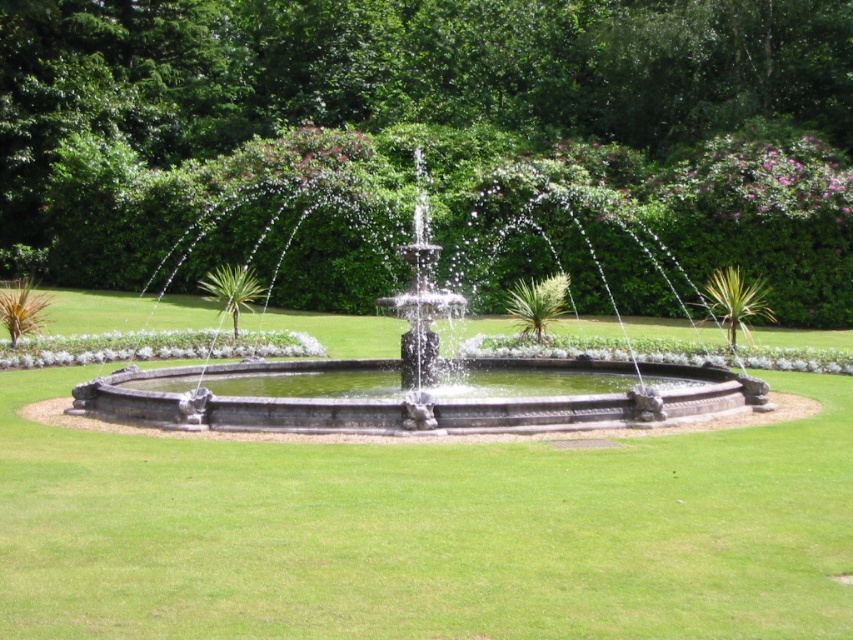
Question: Is green leafy tree at center in front of stone fountain at center?

Choices:
 (A) no
 (B) yes

Answer: (A)

Question: Which of the following is the farthest from the observer?

Choices:
 (A) (772, 289)
 (B) (142, 285)

Answer: (B)

Question: Estimate the real-world distances between objects in this image. Which object is farther from the stone fountain at center?

Choices:
 (A) green grass at center
 (B) green leafy tree at center

Answer: (B)

Question: Can you confirm if green leafy tree at center is positioned below stone fountain at center?

Choices:
 (A) no
 (B) yes

Answer: (A)

Question: Based on their relative distances, which object is nearer to the green grass at center?

Choices:
 (A) green leafy tree at center
 (B) stone fountain at center

Answer: (B)

Question: Is green leafy tree at center wider than green grass at center?

Choices:
 (A) yes
 (B) no

Answer: (A)